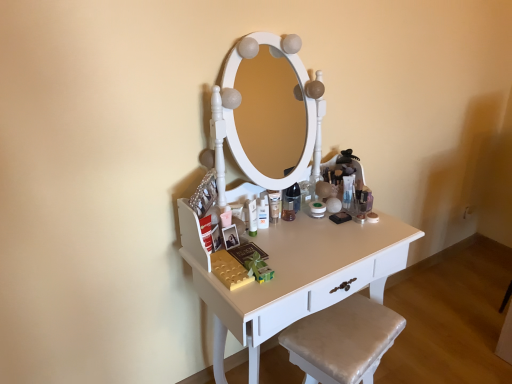
Question: Can you confirm if white glossy table at center is bigger than matte white lotion at center, the second toiletry from the right?

Choices:
 (A) no
 (B) yes

Answer: (B)

Question: Is white glossy table at center oriented away from matte white lotion at center, the second toiletry from the right?

Choices:
 (A) no
 (B) yes

Answer: (A)

Question: Does white glossy table at center appear on the right side of matte white lotion at center, the second toiletry from the right?

Choices:
 (A) no
 (B) yes

Answer: (B)

Question: Is white glossy table at center in front of matte white lotion at center, which is the first toiletry from left to right?

Choices:
 (A) no
 (B) yes

Answer: (B)

Question: Does white glossy table at center contain matte white lotion at center, the second toiletry from the right?

Choices:
 (A) yes
 (B) no

Answer: (B)

Question: Considering the relative sizes of white glossy table at center and matte white lotion at center, the second toiletry from the right, in the image provided, is white glossy table at center taller than matte white lotion at center, the second toiletry from the right,?

Choices:
 (A) yes
 (B) no

Answer: (A)

Question: Is satin beige cushion at lower right positioned behind white glossy table at center?

Choices:
 (A) yes
 (B) no

Answer: (A)

Question: Is white glossy table at center a part of satin beige cushion at lower right?

Choices:
 (A) no
 (B) yes

Answer: (A)

Question: Is satin beige cushion at lower right closer to the viewer compared to white glossy table at center?

Choices:
 (A) yes
 (B) no

Answer: (B)

Question: Is there a large distance between satin beige cushion at lower right and white glossy table at center?

Choices:
 (A) no
 (B) yes

Answer: (A)

Question: Considering the relative sizes of satin beige cushion at lower right and white glossy table at center in the image provided, is satin beige cushion at lower right shorter than white glossy table at center?

Choices:
 (A) no
 (B) yes

Answer: (B)

Question: Is satin beige cushion at lower right turned away from white glossy table at center?

Choices:
 (A) yes
 (B) no

Answer: (A)

Question: Is translucent plastic tube at center, the second toiletry viewed from the left, touching matte white lotion at center, which is the second toiletry in back-to-front order?

Choices:
 (A) no
 (B) yes

Answer: (A)